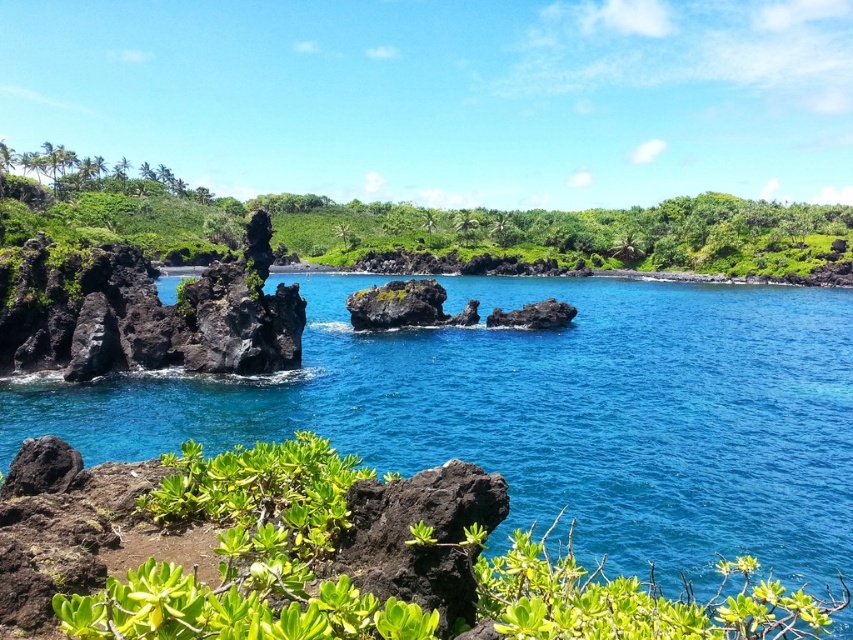
Who is lower down, blue glossy water at center or black volcanic rock at lower left?

black volcanic rock at lower left is below.

Can you confirm if blue glossy water at center is positioned to the right of black volcanic rock at lower left?

Indeed, blue glossy water at center is positioned on the right side of black volcanic rock at lower left.

Identify the location of blue glossy water at center. (549, 416).

Does point (838, 353) come in front of point (563, 305)?

Yes, point (838, 353) is in front of point (563, 305).

Does blue glossy water at center have a smaller size compared to dark brown rock at center?

Actually, blue glossy water at center might be larger than dark brown rock at center.

Is point (755, 364) less distant than point (556, 314)?

Yes, point (755, 364) is closer to viewer.

The height and width of the screenshot is (640, 853). In order to click on blue glossy water at center in this screenshot , I will do `click(549, 416)`.

Between blue glossy water at center and green leafy shrubs at left, which one is positioned higher?

green leafy shrubs at left is higher up.

Which is more to the right, blue glossy water at center or green leafy shrubs at left?

From the viewer's perspective, blue glossy water at center appears more on the right side.

I want to click on blue glossy water at center, so pyautogui.click(x=549, y=416).